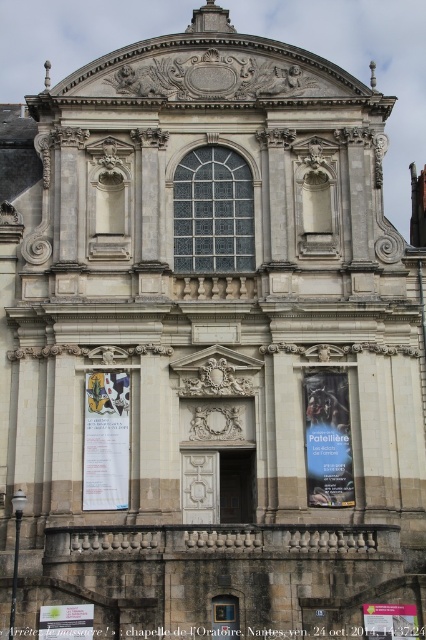
You are standing in front of the chapel of lOratoire in Nantes, France. You see a point at coordinates (328,440). What object is located at this point?

The point at coordinates (328,440) indicates the location of the blue glossy poster at center.

You are a visitor standing in front of the chapel of lOratoire in Nantes, France. You see a matte paper poster at center and a green paper poster at lower left. Which poster is closer to you?

The matte paper poster at center is closer to you because the green paper poster at lower left is behind it.

You are standing in front of the chapel of lOratoire in Nantes, France. You see a blue glossy poster at center and a green paper poster at lower left. Which poster is taller?

The blue glossy poster at center is taller than the green paper poster at lower left.